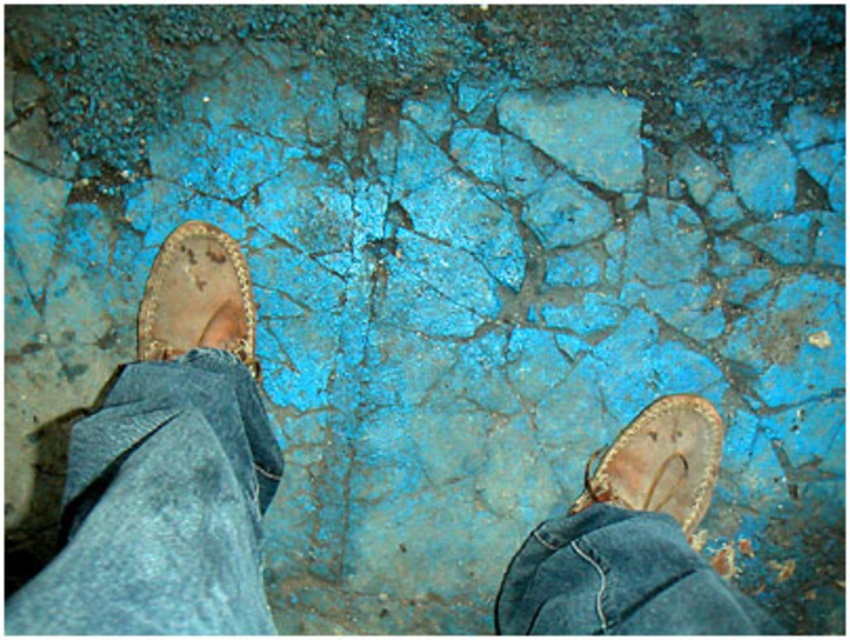
Can you confirm if denim at lower left is shorter than leather sandal at lower right?

In fact, denim at lower left may be taller than leather sandal at lower right.

Who is positioned more to the left, denim at lower left or leather sandal at lower right?

From the viewer's perspective, denim at lower left appears more on the left side.

What are the coordinates of `denim at lower left` in the screenshot? It's located at (162, 508).

The width and height of the screenshot is (850, 640). In order to click on denim at lower left in this screenshot , I will do `click(162, 508)`.

Between denim at lower right and leather sandal at left, which one has less height?

denim at lower right is shorter.

Can you confirm if denim at lower right is thinner than leather sandal at left?

Incorrect, denim at lower right's width is not less than leather sandal at left's.

The height and width of the screenshot is (640, 850). Find the location of `denim at lower right`. denim at lower right is located at coordinates (616, 580).

Where is `denim at lower right`? denim at lower right is located at coordinates (616, 580).

Image resolution: width=850 pixels, height=640 pixels. Identify the location of leather sandal at lower right. (659, 461).

Is leather sandal at lower right closer to the viewer compared to leather sandal at left?

That is False.

Between point (639, 422) and point (187, 276), which one is positioned in front?

Positioned in front is point (187, 276).

Where is `leather sandal at lower right`? The height and width of the screenshot is (640, 850). leather sandal at lower right is located at coordinates (659, 461).